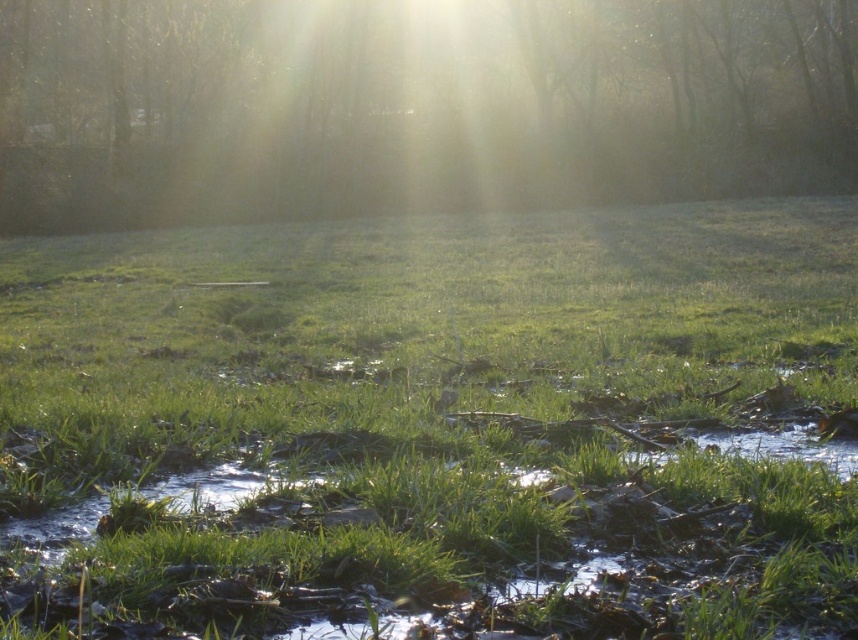
Question: Which point is closer to the camera taking this photo?

Choices:
 (A) (411, 582)
 (B) (301, 36)

Answer: (A)

Question: Is the position of green grassy at center less distant than that of translucent foggy trees at upper center?

Choices:
 (A) no
 (B) yes

Answer: (B)

Question: Does green grassy at center have a smaller size compared to translucent foggy trees at upper center?

Choices:
 (A) no
 (B) yes

Answer: (B)

Question: Can you confirm if green grassy at center is positioned below translucent foggy trees at upper center?

Choices:
 (A) no
 (B) yes

Answer: (B)